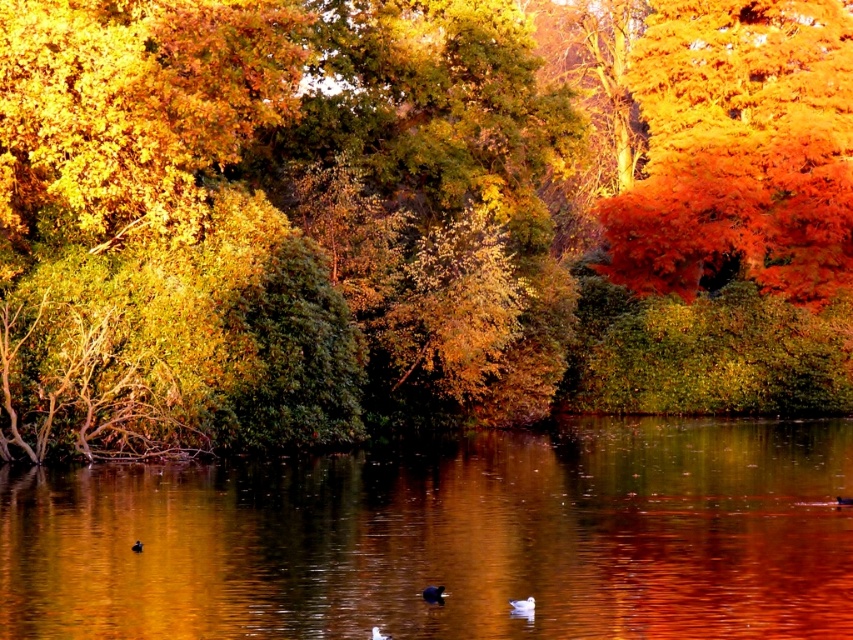
Is the position of smooth reflective water at center more distant than that of black matte duck at center?

No, it is not.

Does smooth reflective water at center appear over black matte duck at center?

No.

Does point (466, 451) come closer to viewer compared to point (843, 506)?

No, it is behind (843, 506).

In order to click on smooth reflective water at center in this screenshot , I will do `click(450, 538)`.

Between black matte duck at center and white matte duck at lower center, which one appears on the right side from the viewer's perspective?

black matte duck at center is more to the right.

Between black matte duck at center and white matte duck at lower center, which one has more height?

black matte duck at center

The image size is (853, 640). What do you see at coordinates (843, 500) in the screenshot? I see `black matte duck at center` at bounding box center [843, 500].

The width and height of the screenshot is (853, 640). Identify the location of black matte duck at center. (843, 500).

Does black matte duck at center have a greater height compared to matte brown duck at lower center?

Incorrect, black matte duck at center's height is not larger of matte brown duck at lower center's.

Which is behind, point (838, 499) or point (132, 548)?

Positioned behind is point (838, 499).

Where is `black matte duck at center`? The image size is (853, 640). black matte duck at center is located at coordinates (843, 500).

Find the location of a particular element. The width and height of the screenshot is (853, 640). black matte duck at center is located at coordinates (843, 500).